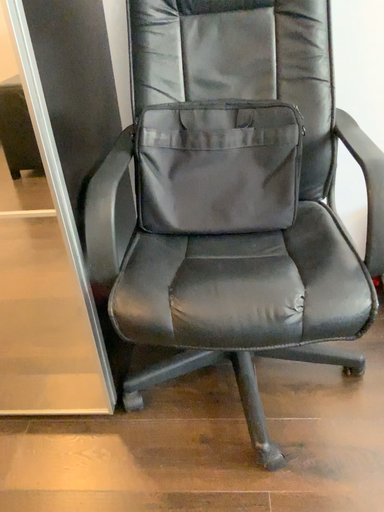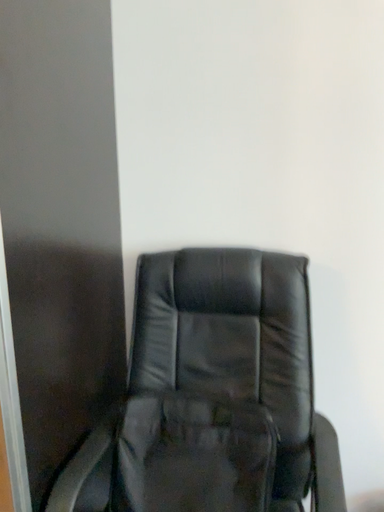
Question: Which way did the camera rotate in the video?

Choices:
 (A) rotated downward
 (B) rotated upward

Answer: (B)